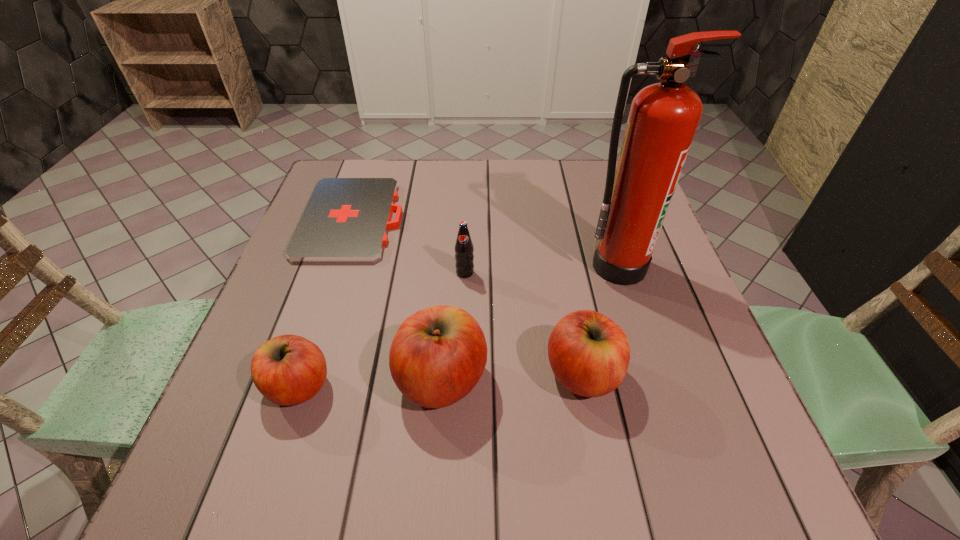
Where is `vacant space that satisfies the following two spatial constraints: 1. on handle side the first-aid kit; 2. on the left side of the leftmost apple`? The height and width of the screenshot is (540, 960). vacant space that satisfies the following two spatial constraints: 1. on handle side the first-aid kit; 2. on the left side of the leftmost apple is located at coordinates (298, 386).

This screenshot has width=960, height=540. Find the location of `blank area in the image that satisfies the following two spatial constraints: 1. on the back side of the second apple from left to right; 2. on the right side of the second shortest apple`. blank area in the image that satisfies the following two spatial constraints: 1. on the back side of the second apple from left to right; 2. on the right side of the second shortest apple is located at coordinates (443, 374).